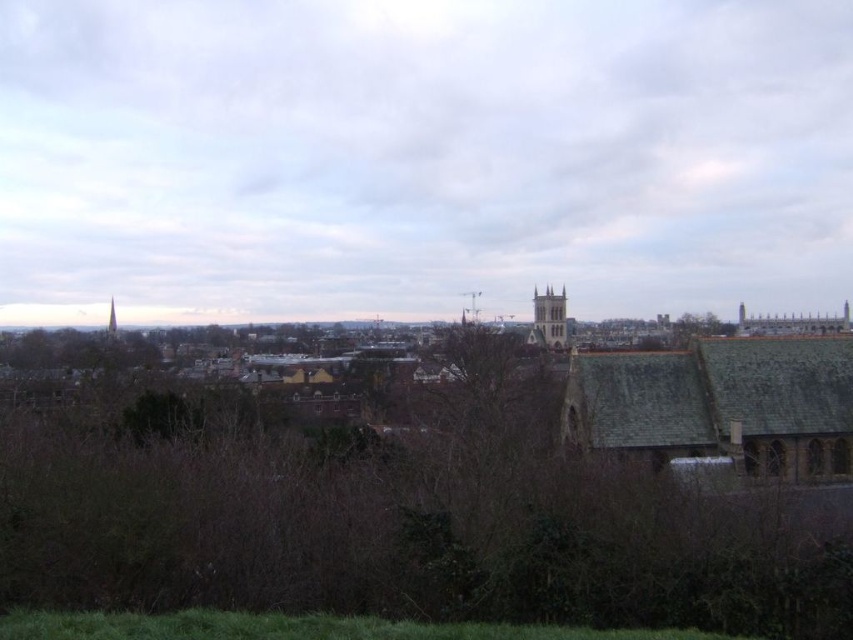
Who is shorter, light brown stone tower at center or green leafy tree at upper center?

green leafy tree at upper center is shorter.

The width and height of the screenshot is (853, 640). Find the location of `light brown stone tower at center`. light brown stone tower at center is located at coordinates (549, 317).

From the picture: Does brown leafless tree at center appear on the right side of smooth gray spire at upper center?

Yes, brown leafless tree at center is to the right of smooth gray spire at upper center.

Does brown leafless tree at center appear on the left side of smooth gray spire at upper center?

In fact, brown leafless tree at center is to the right of smooth gray spire at upper center.

What do you see at coordinates (434, 497) in the screenshot? The image size is (853, 640). I see `brown leafless tree at center` at bounding box center [434, 497].

The image size is (853, 640). In order to click on brown leafless tree at center in this screenshot , I will do `click(434, 497)`.

Which is more to the left, brown leafless tree at center or light brown stone tower at center?

brown leafless tree at center is more to the left.

How distant is brown leafless tree at center from light brown stone tower at center?

A distance of 79.62 meters exists between brown leafless tree at center and light brown stone tower at center.

Is point (811, 525) positioned in front of point (543, 300)?

That is True.

I want to click on brown leafless tree at center, so pos(434,497).